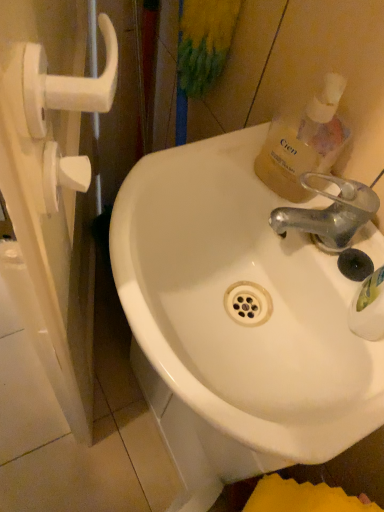
Question: Is metallic silver faucet at upper right completely or partially inside white glossy sink at center?

Choices:
 (A) no
 (B) yes

Answer: (A)

Question: Is white glossy sink at center located outside metallic silver faucet at upper right?

Choices:
 (A) no
 (B) yes

Answer: (B)

Question: From a real-world perspective, is white glossy sink at center physically above metallic silver faucet at upper right?

Choices:
 (A) yes
 (B) no

Answer: (B)

Question: Does white glossy sink at center have a smaller size compared to metallic silver faucet at upper right?

Choices:
 (A) yes
 (B) no

Answer: (B)

Question: From the image's perspective, would you say white glossy sink at center is shown under metallic silver faucet at upper right?

Choices:
 (A) yes
 (B) no

Answer: (A)

Question: Considering the positions of point (326, 244) and point (64, 168), is point (326, 244) closer or farther from the camera than point (64, 168)?

Choices:
 (A) closer
 (B) farther

Answer: (B)

Question: Considering the positions of metallic silver faucet at upper right and white plastic handle at left in the image, is metallic silver faucet at upper right wider or thinner than white plastic handle at left?

Choices:
 (A) thin
 (B) wide

Answer: (B)

Question: From the image's perspective, is metallic silver faucet at upper right above or below white plastic handle at left?

Choices:
 (A) below
 (B) above

Answer: (A)

Question: From a real-world perspective, is metallic silver faucet at upper right above or below white plastic handle at left?

Choices:
 (A) below
 (B) above

Answer: (B)

Question: Is metallic silver faucet at upper right bigger or smaller than translucent plastic bottle at upper right?

Choices:
 (A) small
 (B) big

Answer: (A)

Question: From the image's perspective, relative to translucent plastic bottle at upper right, is metallic silver faucet at upper right above or below?

Choices:
 (A) below
 (B) above

Answer: (A)

Question: Relative to translucent plastic bottle at upper right, is metallic silver faucet at upper right in front or behind?

Choices:
 (A) front
 (B) behind

Answer: (B)

Question: Is metallic silver faucet at upper right inside the boundaries of translucent plastic bottle at upper right, or outside?

Choices:
 (A) outside
 (B) inside

Answer: (A)

Question: In terms of height, does white glossy sink at center look taller or shorter compared to metallic silver faucet at upper right?

Choices:
 (A) short
 (B) tall

Answer: (B)

Question: From a real-world perspective, relative to metallic silver faucet at upper right, is white glossy sink at center vertically above or below?

Choices:
 (A) above
 (B) below

Answer: (B)